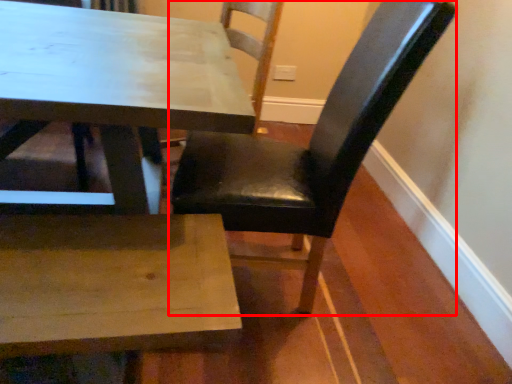
Question: In this image, where is chair (annotated by the red box) located relative to chair?

Choices:
 (A) left
 (B) right

Answer: (B)